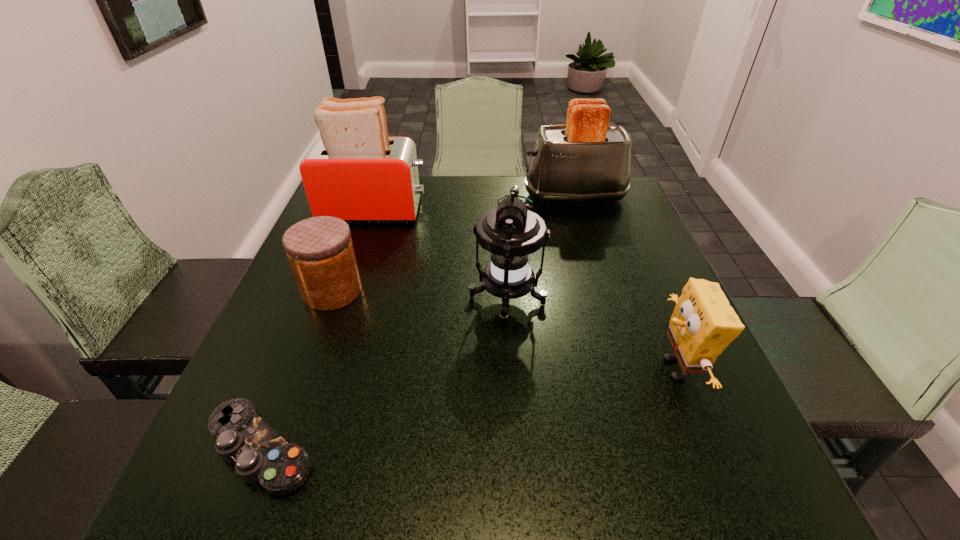
In order to click on toaster situated at the right edge in this screenshot , I will do `click(585, 160)`.

Locate an element on the screen. This screenshot has width=960, height=540. sponge present at the right edge is located at coordinates (703, 324).

Locate an element on the screen. This screenshot has width=960, height=540. object located at the far left corner is located at coordinates (354, 171).

This screenshot has width=960, height=540. In order to click on object at the near left corner in this screenshot , I will do `click(261, 455)`.

Find the location of a particular element. Image resolution: width=960 pixels, height=540 pixels. object located at the far right corner is located at coordinates (585, 160).

In the image, there is a desktop. Identify the location of vacant space at the far edge. (475, 192).

You are a GUI agent. You are given a task and a screenshot of the screen. Output one action in this format:
    pyautogui.click(x=<x>, y=<y>)
    Task: Click on the vacant region at the near edge of the desktop
    
    Given the screenshot: What is the action you would take?
    [x=627, y=480]

The image size is (960, 540). What are the coordinates of `free region at the left edge` in the screenshot? It's located at pos(300,433).

Where is `free location at the right edge of the desktop`? The width and height of the screenshot is (960, 540). free location at the right edge of the desktop is located at coordinates (599, 246).

You are a GUI agent. You are given a task and a screenshot of the screen. Output one action in this format:
    pyautogui.click(x=<x>, y=<y>)
    Task: Click on the free space at the near left corner
    The image size is (960, 540).
    Given the screenshot: What is the action you would take?
    pyautogui.click(x=261, y=508)